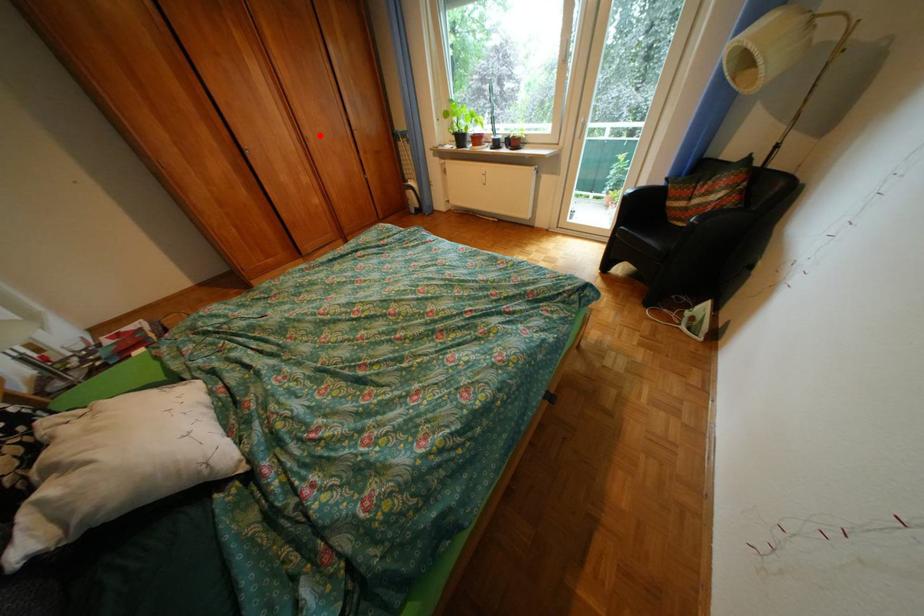
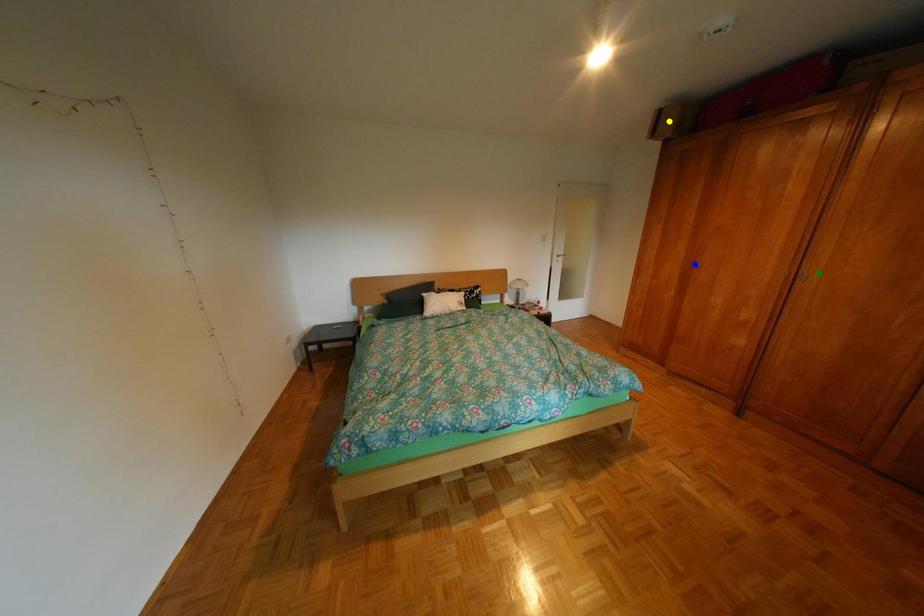
Question: I am providing you with two images of the same scene from different viewpoints. A red point is marked on the first image. You are given multiple points on the second image. Which point in image 2 represents the same 3d spot as the red point in image 1?

Choices:
 (A) green point
 (B) yellow point
 (C) blue point

Answer: (A)